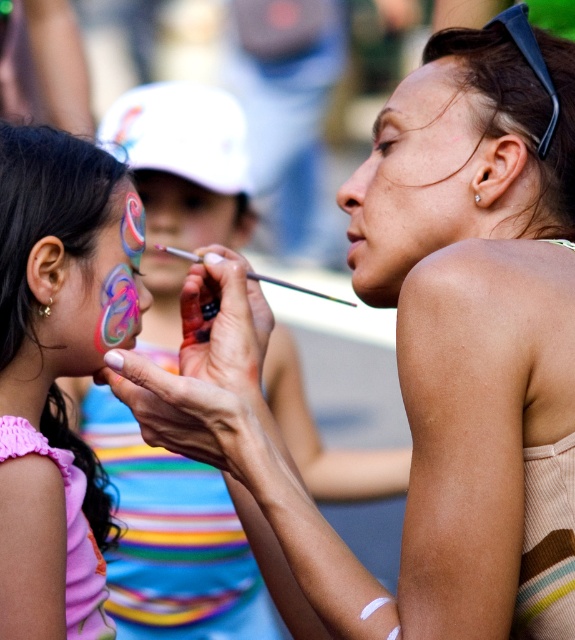
Can you confirm if shiny pink face paint at left is taller than matte skin at center?

Correct, shiny pink face paint at left is much taller as matte skin at center.

Who is more distant from viewer, (x=21, y=301) or (x=461, y=212)?

Point (x=21, y=301)

Find the location of a particular element. shiny pink face paint at left is located at coordinates (58, 371).

Does matte skin at center lie in front of matte paintbrush at center?

Yes, it is.

The width and height of the screenshot is (575, 640). I want to click on matte skin at center, so click(x=419, y=180).

Is point (70, 321) closer to viewer compared to point (185, 244)?

Yes, it is.

Is shiny metallic face paint at left taller than matte paintbrush at center?

Incorrect, shiny metallic face paint at left's height is not larger of matte paintbrush at center's.

I want to click on shiny metallic face paint at left, so [102, 289].

Locate an element on the screen. shiny metallic face paint at left is located at coordinates (102, 289).